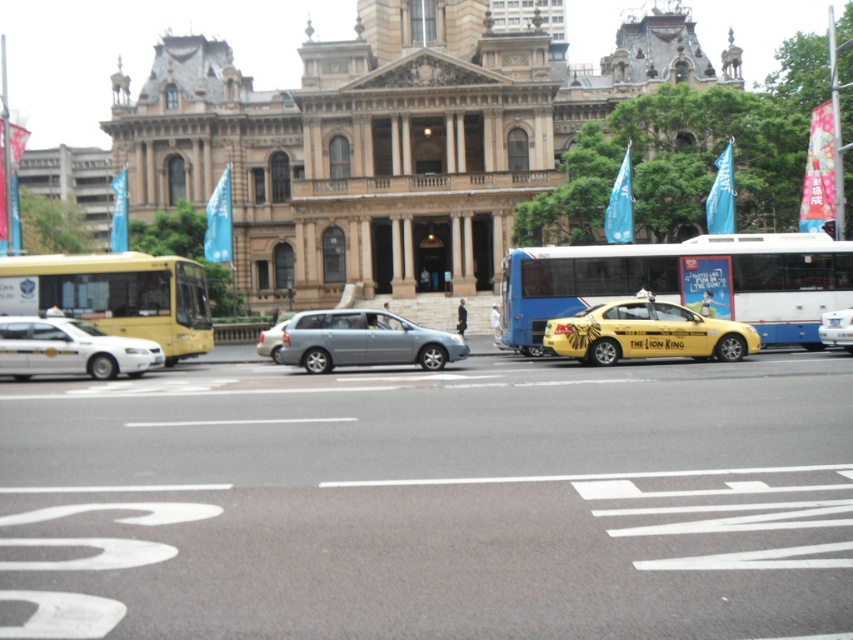
Between point (810, 296) and point (264, 340), which one is positioned behind?

The point (264, 340) is more distant.

Can you confirm if blue metallic bus at center is bigger than satin silver sedan at center?

Yes.

This screenshot has height=640, width=853. I want to click on blue metallic bus at center, so click(x=683, y=282).

Does satin silver van at center have a greater height compared to white glossy sedan at left?

No, satin silver van at center is not taller than white glossy sedan at left.

Is satin silver van at center below white glossy sedan at left?

Indeed, satin silver van at center is positioned under white glossy sedan at left.

In order to click on satin silver van at center in this screenshot , I will do `click(364, 340)`.

Identify the location of satin silver van at center. This screenshot has height=640, width=853. (364, 340).

Looking at this image, between satin silver van at center and satin silver sedan at center, which one is positioned higher?

satin silver sedan at center is above.

Based on the photo, is satin silver van at center positioned at the back of satin silver sedan at center?

No, satin silver van at center is closer to the viewer.

I want to click on satin silver van at center, so click(364, 340).